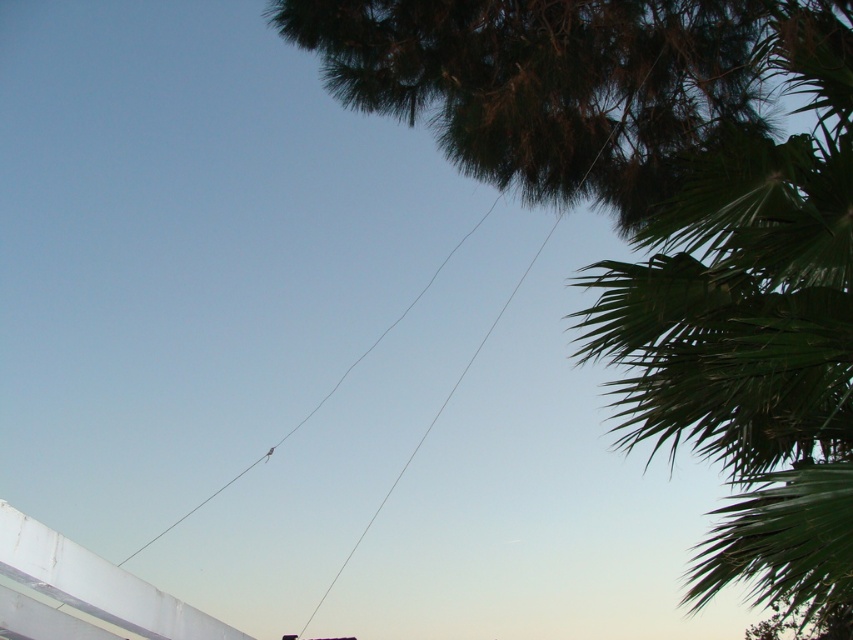
You are a photographer trying to capture a shot of the green leafy palm tree at upper right without the clear wire at center appearing in the frame. Based on their heights, is it possible to angle your camera downward to avoid the wire?

The green leafy palm tree at upper right has a greater height compared to the clear wire at center. Since the palm tree is taller, angling the camera downward might allow you to frame the shot so the wire is below the tree, avoiding it in the composition.

You are a bird looking for a place to perch. You see two trees in the image, the green leafy tree at upper right and the green leafy palm tree at upper right. Which tree is taller?

The green leafy palm tree at upper right is taller than the green leafy tree at upper right according to the description.

You are standing in the outdoor scene and want to take a photo of the green leafy tree at upper right. To avoid including the thin, straight wire that stretches diagonally from the bottom left to the upper right, where should you position yourself relative to the point marked as point (666, 220)?

To avoid the wire, position yourself to the left of point (666, 220) since the wire runs diagonally from the bottom left to the upper right, and the tree is located at that point.